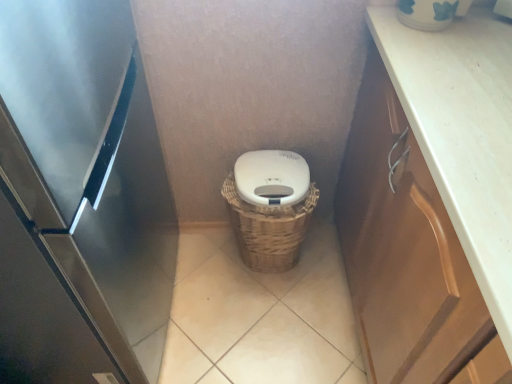
Locate an element on the screen. vacant space in between stainless steel refrigerator at left and woven brown basket at center is located at coordinates (213, 301).